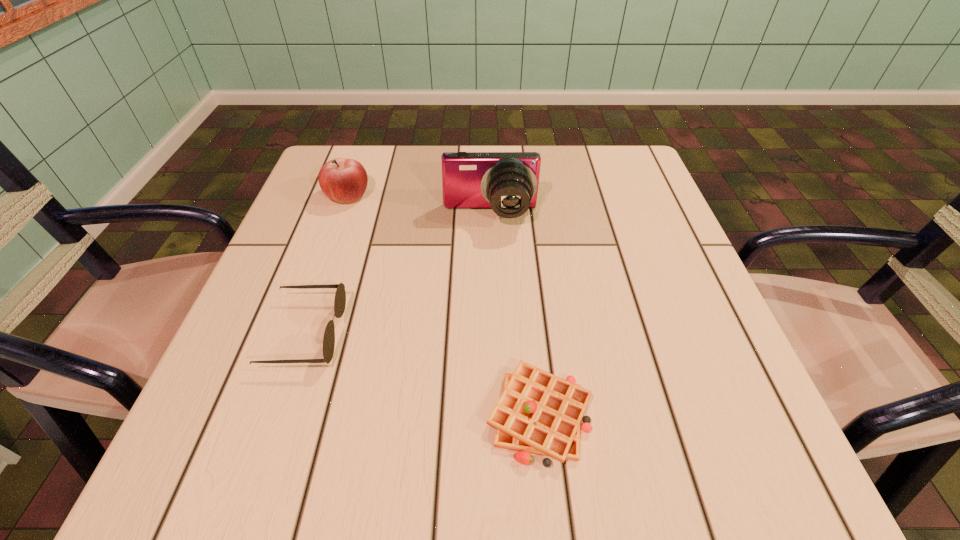
Where is `free space that is in between the third shortest object and the shortest object`? The height and width of the screenshot is (540, 960). free space that is in between the third shortest object and the shortest object is located at coordinates (444, 305).

Where is `empty space that is in between the shortest object and the second tallest object`? This screenshot has width=960, height=540. empty space that is in between the shortest object and the second tallest object is located at coordinates (444, 305).

You are a GUI agent. You are given a task and a screenshot of the screen. Output one action in this format:
    pyautogui.click(x=<x>, y=<y>)
    Task: Click on the empty space between the sunglasses and the third shortest object
    
    Given the screenshot: What is the action you would take?
    pyautogui.click(x=326, y=264)

Locate an element on the screen. free space between the sunglasses and the apple is located at coordinates (326, 264).

At what (x,y) coordinates should I click in order to perform the action: click on vacant area between the second tallest object and the sunglasses. Please return your answer as a coordinate pair (x, y). This screenshot has height=540, width=960. Looking at the image, I should click on (326, 264).

The width and height of the screenshot is (960, 540). I want to click on free space between the third shortest object and the tallest object, so click(419, 205).

Locate an element on the screen. vacant point located between the waffle and the camera is located at coordinates (515, 315).

The image size is (960, 540). In order to click on unoccupied position between the second shortest object and the camera in this screenshot , I will do `click(397, 274)`.

Find the location of a particular element. The height and width of the screenshot is (540, 960). the third closest object to the second tallest object is located at coordinates (539, 413).

Select which object is the second closest to the tallest object. Please provide its 2D coordinates. Your answer should be formatted as a tuple, i.e. [(x, y)], where the tuple contains the x and y coordinates of a point satisfying the conditions above.

[(340, 296)]